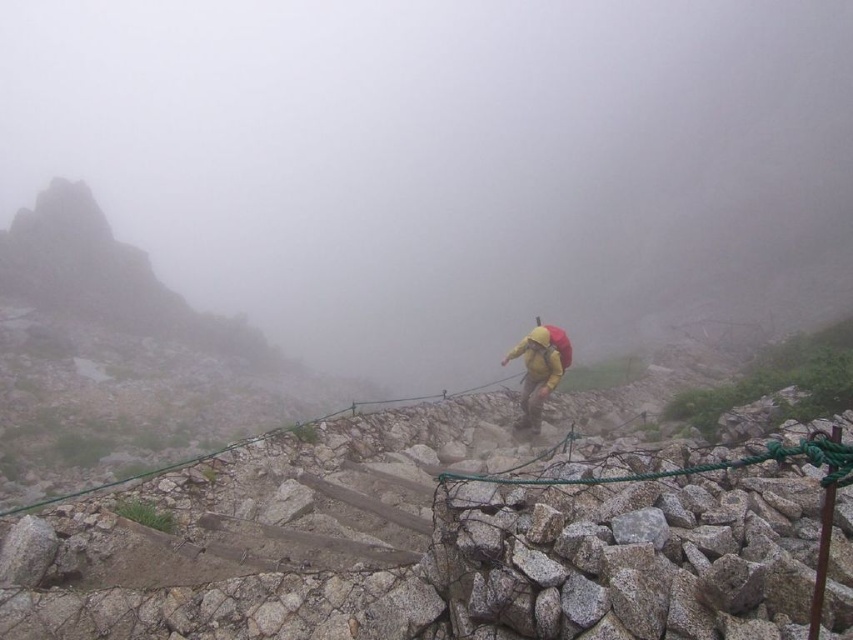
Does point (820, 445) come farther from viewer compared to point (537, 352)?

No, it is not.

Which is more to the left, green rope at center or yellow fabric backpack at center?

green rope at center is more to the left.

Who is more distant from viewer, (634, 481) or (560, 337)?

Positioned behind is point (560, 337).

Locate an element on the screen. The image size is (853, 640). green rope at center is located at coordinates (712, 465).